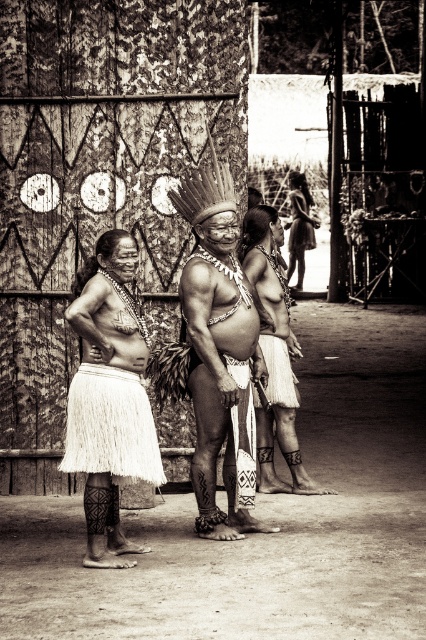
Is smooth skin man at center to the left of white fringed skirt at left from the viewer's perspective?

In fact, smooth skin man at center is to the right of white fringed skirt at left.

This screenshot has height=640, width=426. What do you see at coordinates (221, 353) in the screenshot? I see `smooth skin man at center` at bounding box center [221, 353].

Which is in front, point (201, 499) or point (106, 346)?

Point (106, 346) is more forward.

The width and height of the screenshot is (426, 640). Identify the location of smooth skin man at center. (221, 353).